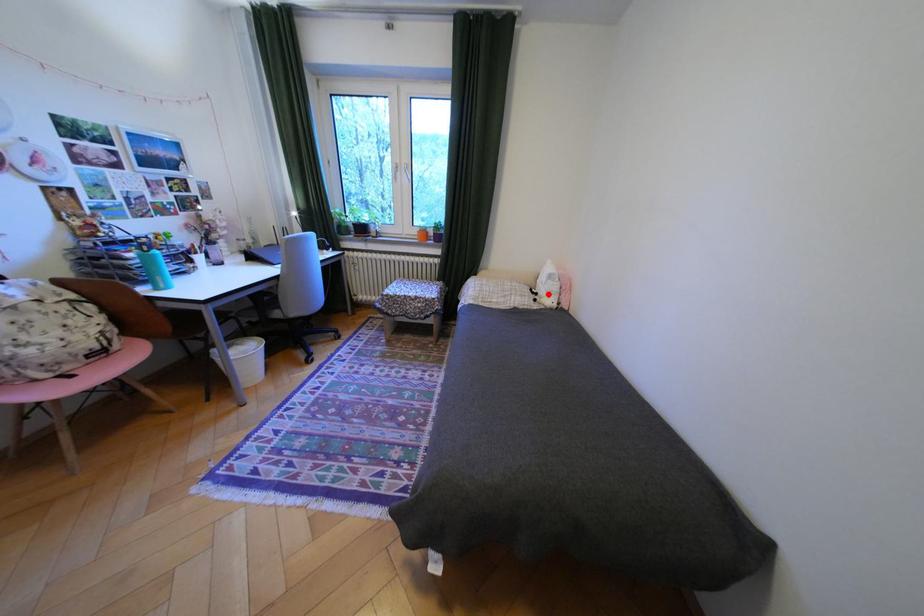
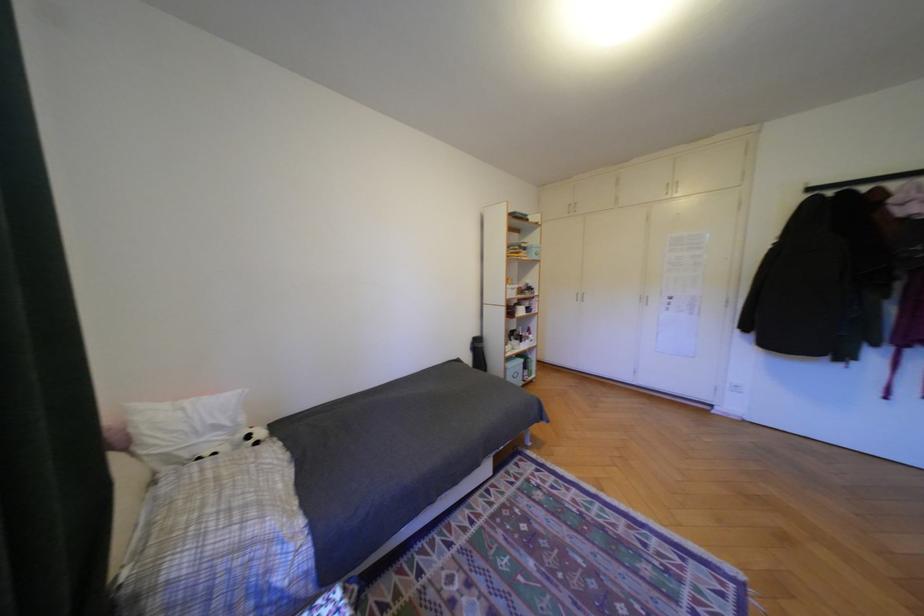
In the second image, find the point that corresponds to the highlighted location in the first image.

(261, 437)